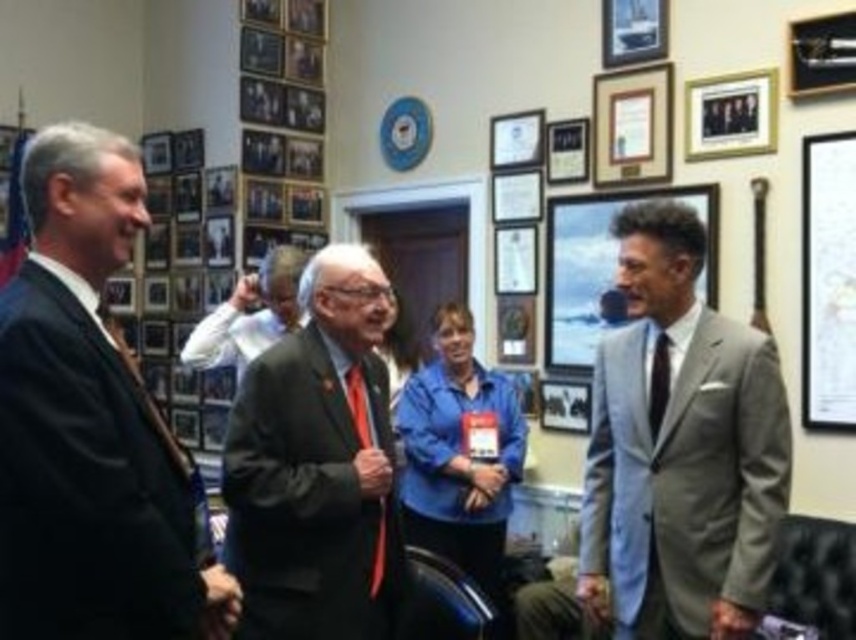
You are an interior designer assessing the office layout. You notice two wooden frames on the wall. Which one is taller between the wooden framed photo at upper right and the wooden picture frame at upper center?

The wooden framed photo at upper right is taller than the wooden picture frame at upper center.